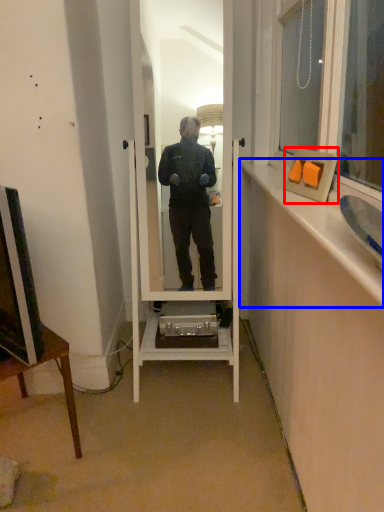
Question: Which of the following is the farthest to the observer, picture frame (highlighted by a red box) or window sill (highlighted by a blue box)?

Choices:
 (A) picture frame
 (B) window sill

Answer: (A)